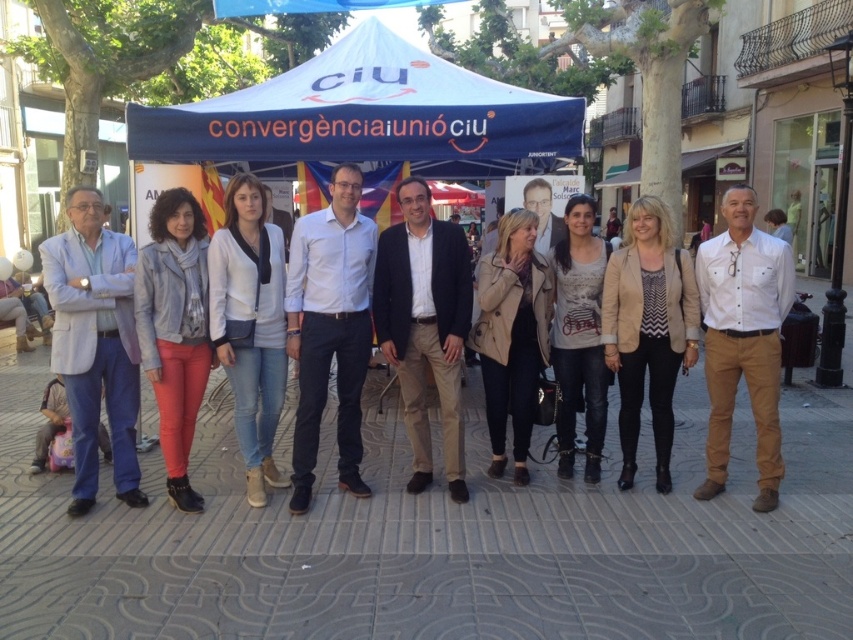
You are a photographer positioned at the front of the scene. You need to capture a clear photo of both the white cotton shirt at center and the white matte jacket at center. Which one will appear larger in your photo?

The white cotton shirt at center will appear larger in the photo because it is closer to the viewer than the white matte jacket at center.

You are a photographer holding a camera and want to take a clear photo of the white cotton shirt at center without any blur. If your camera requires a minimum distance of 4 meters to focus properly, can you take the photo from your current position?

The distance between the white cotton shirt at center and the camera is 4.34 meters, which is greater than the required 4 meters. Therefore, you can take a clear photo without blur.